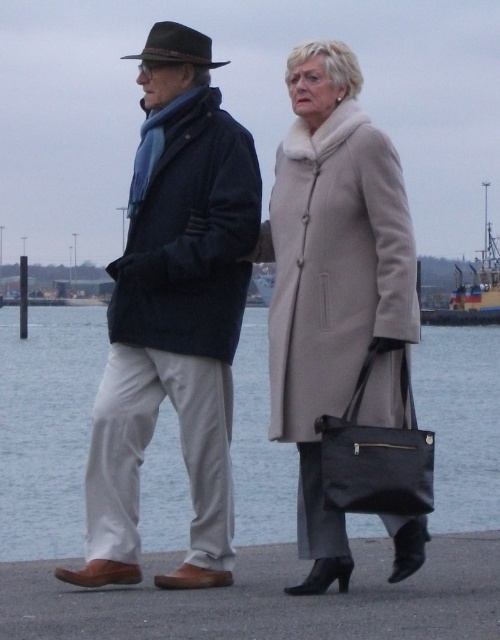
Question: Considering the real-world distances, which object is closest to the metallic gray boat at center?

Choices:
 (A) velvet blue scarf at left
 (B) beige wool coat at center
 (C) clear water at lower center

Answer: (C)

Question: Which object is the closest to the metallic gray boat at center?

Choices:
 (A) beige wool coat at center
 (B) clear water at lower center
 (C) velvet blue scarf at left

Answer: (B)

Question: Does velvet blue scarf at left have a lesser width compared to beige wool coat at center?

Choices:
 (A) no
 (B) yes

Answer: (A)

Question: Does clear water at lower center appear under beige wool coat at center?

Choices:
 (A) no
 (B) yes

Answer: (B)

Question: Which object appears farthest from the camera in this image?

Choices:
 (A) velvet blue scarf at left
 (B) clear water at lower center
 (C) beige wool coat at center

Answer: (A)

Question: From the image, what is the correct spatial relationship of clear water at lower center in relation to metallic gray boat at center?

Choices:
 (A) above
 (B) below

Answer: (B)